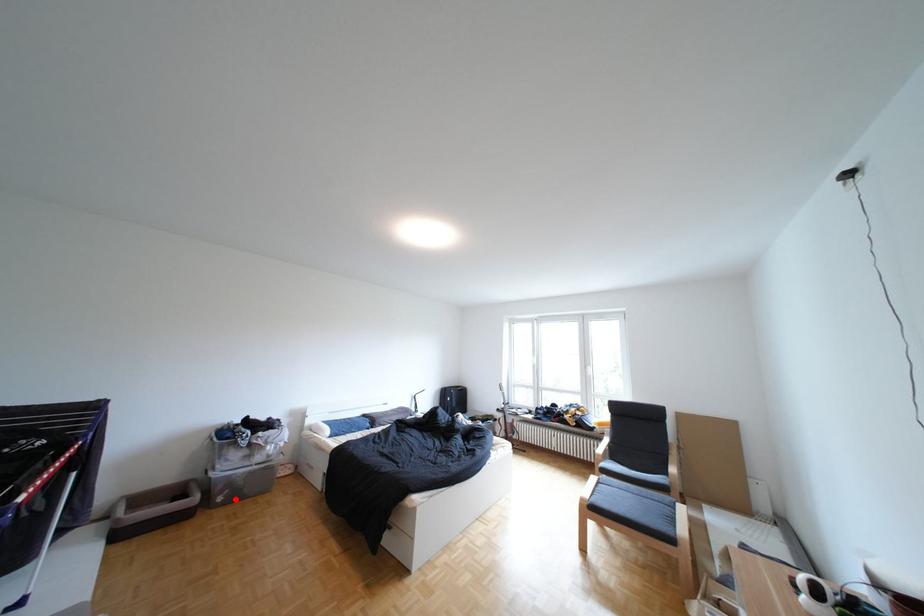
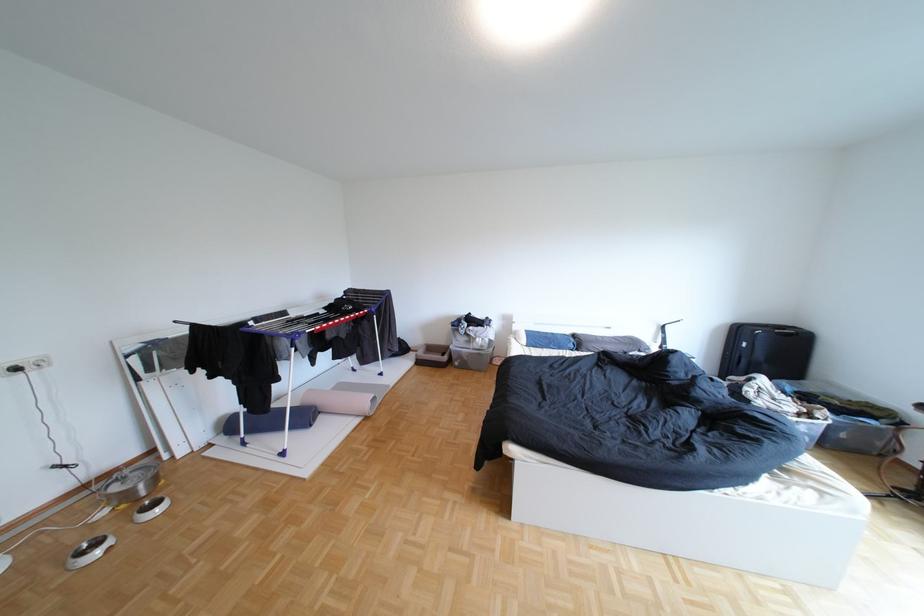
The point at the highlighted location is marked in the first image. Where is the corresponding point in the second image?

(472, 363)